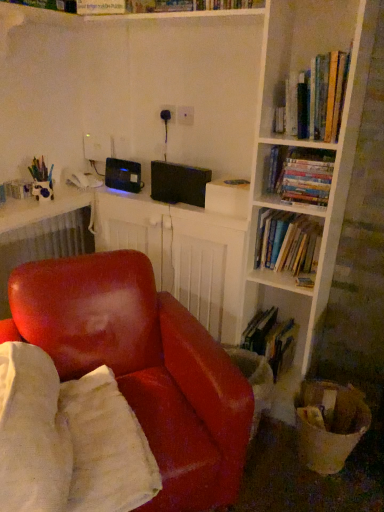
Describe the element at coordinates (167, 113) in the screenshot. I see `matte black outlet at upper center` at that location.

Identify the location of leather at center. The height and width of the screenshot is (512, 384). (143, 366).

At what (x,y) coordinates should I click in order to perform the action: click on hardcover books at upper right, placed as the 3th book when sorted from bottom to top. Please return your answer as a coordinate pair (x, y). The image size is (384, 512). Looking at the image, I should click on (300, 174).

Identify the location of hardcover book at upper center. The width and height of the screenshot is (384, 512). (228, 197).

Is hardcover book at lower center, arranged as the 4th book when viewed from the top, shorter than hardcover books at upper right, acting as the first book starting from the top?

No, hardcover book at lower center, arranged as the 4th book when viewed from the top, is not shorter than hardcover books at upper right, acting as the first book starting from the top.

Looking at this image, is hardcover book at lower center, which is the first book in bottom-to-top order, positioned behind hardcover books at upper right, acting as the first book starting from the top?

Yes, it is behind hardcover books at upper right, acting as the first book starting from the top.

I want to click on the 3rd book to the right when counting from the hardcover book at lower center, arranged as the 4th book when viewed from the top, so click(315, 99).

How different are the orientations of hardcover book at lower center, which is the first book in bottom-to-top order, and hardcover books at upper right, acting as the first book starting from the top, in degrees?

There is a 0.000591-degree angle between the facing directions of hardcover book at lower center, which is the first book in bottom-to-top order, and hardcover books at upper right, acting as the first book starting from the top.

Visually, is hardcover books at upper right, which is counted as the fourth book, starting from the bottom, positioned to the left or to the right of white textured radiator at upper left?

hardcover books at upper right, which is counted as the fourth book, starting from the bottom, is to the right of white textured radiator at upper left.

Does point (280, 130) come closer to viewer compared to point (89, 241)?

Yes, point (280, 130) is closer to viewer.

How far apart are hardcover books at upper right, acting as the first book starting from the top, and white textured radiator at upper left?

hardcover books at upper right, acting as the first book starting from the top, and white textured radiator at upper left are 1.35 meters apart.

Is hardcover books at upper right, which is counted as the fourth book, starting from the bottom, positioned with its back to white textured radiator at upper left?

No, hardcover books at upper right, which is counted as the fourth book, starting from the bottom, is not facing the opposite direction of white textured radiator at upper left.

Would you say hardcover book at upper center contains black plastic speaker at center?

No, hardcover book at upper center does not contain black plastic speaker at center.

From a real-world perspective, who is located higher, hardcover book at upper center or black plastic speaker at center?

black plastic speaker at center.

Is hardcover book at upper center aimed at black plastic speaker at center?

No, hardcover book at upper center is not turned towards black plastic speaker at center.

Are hardcover book at upper center and black plastic speaker at center located far from each other?

No, hardcover book at upper center is not far from black plastic speaker at center.

Are hardcover books at upper right, which is counted as the fourth book, starting from the bottom, and hardcover book at lower center, which is the first book in bottom-to-top order, far apart?

No, hardcover books at upper right, which is counted as the fourth book, starting from the bottom, is not far from hardcover book at lower center, which is the first book in bottom-to-top order.

Between hardcover books at upper right, acting as the first book starting from the top, and hardcover book at lower center, arranged as the 4th book when viewed from the top, which one has more height?

Standing taller between the two is hardcover book at lower center, arranged as the 4th book when viewed from the top.

Considering their positions, is hardcover books at upper right, which is counted as the fourth book, starting from the bottom, located in front of or behind hardcover book at lower center, which is the first book in bottom-to-top order?

Clearly, hardcover books at upper right, which is counted as the fourth book, starting from the bottom, is in front of hardcover book at lower center, which is the first book in bottom-to-top order.

From a real-world perspective, which is physically above, hardcover books at upper right, which is counted as the fourth book, starting from the bottom, or hardcover book at lower center, arranged as the 4th book when viewed from the top?

hardcover books at upper right, which is counted as the fourth book, starting from the bottom, is physically above.

Where is `book that is the 2nd one when counting backward from the hardcover books at upper right, positioned as the second book in top-to-bottom order`? book that is the 2nd one when counting backward from the hardcover books at upper right, positioned as the second book in top-to-bottom order is located at coordinates (271, 339).

Considering the sizes of hardcover books at upper right, placed as the 3th book when sorted from bottom to top, and hardcover book at lower center, which is the first book in bottom-to-top order, in the image, is hardcover books at upper right, placed as the 3th book when sorted from bottom to top, taller or shorter than hardcover book at lower center, which is the first book in bottom-to-top order,?

In the image, hardcover books at upper right, placed as the 3th book when sorted from bottom to top, appears to be shorter than hardcover book at lower center, which is the first book in bottom-to-top order.

From the image's perspective, which object appears higher, hardcover books at upper right, placed as the 3th book when sorted from bottom to top, or hardcover book at lower center, which is the first book in bottom-to-top order?

hardcover books at upper right, placed as the 3th book when sorted from bottom to top, is shown above in the image.

Is hardcover books at upper right, placed as the 3th book when sorted from bottom to top, next to hardcover book at lower center, which is the first book in bottom-to-top order, and touching it?

No, hardcover books at upper right, placed as the 3th book when sorted from bottom to top, is not beside hardcover book at lower center, which is the first book in bottom-to-top order.

Is hardcover books at center right, placed as the 3th book when sorted from top to bottom, not inside black plastic computer desk at center?

That's correct, hardcover books at center right, placed as the 3th book when sorted from top to bottom, is outside of black plastic computer desk at center.

Is hardcover books at center right, positioned as the second book in bottom-to-top order, next to black plastic computer desk at center?

There is a gap between hardcover books at center right, positioned as the second book in bottom-to-top order, and black plastic computer desk at center.

From a real-world perspective, is hardcover books at center right, positioned as the second book in bottom-to-top order, under black plastic computer desk at center?

Actually, hardcover books at center right, positioned as the second book in bottom-to-top order, is physically above black plastic computer desk at center in the real world.

Is hardcover books at center right, placed as the 3th book when sorted from top to bottom, thinner than black plastic computer desk at center?

Indeed, hardcover books at center right, placed as the 3th book when sorted from top to bottom, has a lesser width compared to black plastic computer desk at center.

This screenshot has height=512, width=384. Identify the location of electric outlet that is on the left side of black plastic speaker at center. (167, 113).

Which of these two, matte black outlet at upper center or black plastic speaker at center, is thinner?

Thinner between the two is matte black outlet at upper center.

Does point (174, 115) lie in front of point (208, 179)?

No, it is not.

Are matte black outlet at upper center and black plastic speaker at center beside each other?

No, matte black outlet at upper center is not with black plastic speaker at center.

You are a GUI agent. You are given a task and a screenshot of the screen. Output one action in this format:
    pyautogui.click(x=<x>, y=<y>)
    Task: Click on the 3rd book behind the hardcover books at upper right, which is counted as the fourth book, starting from the bottom
    This screenshot has width=384, height=512.
    Given the screenshot: What is the action you would take?
    pyautogui.click(x=271, y=339)

Image resolution: width=384 pixels, height=512 pixels. Find the location of `radiator below the hardcover books at upper right, acting as the first book starting from the top (from the image's perspective)`. radiator below the hardcover books at upper right, acting as the first book starting from the top (from the image's perspective) is located at coordinates (43, 245).

Considering their positions, is hardcover books at upper right, placed as the 3th book when sorted from bottom to top, positioned closer to white textured radiator at upper left than hardcover book at upper center?

→ Among the two, hardcover book at upper center is located nearer to white textured radiator at upper left.

Estimate the real-world distances between objects in this image. Which object is further from black plastic speaker at center, hardcover book at upper center or hardcover book at lower center, arranged as the 4th book when viewed from the top?

Among the two, hardcover book at lower center, arranged as the 4th book when viewed from the top, is located further to black plastic speaker at center.

Looking at the image, which one is located further to hardcover books at upper right, which is counted as the fourth book, starting from the bottom, matte black outlet at upper center or hardcover books at upper right, placed as the 3th book when sorted from bottom to top?

The object further to hardcover books at upper right, which is counted as the fourth book, starting from the bottom, is matte black outlet at upper center.

In the scene shown: From the image, which object appears to be farther from leather at center, hardcover books at center right, placed as the 3th book when sorted from top to bottom, or hardcover book at lower center, which is the first book in bottom-to-top order?

The object further to leather at center is hardcover books at center right, placed as the 3th book when sorted from top to bottom.

Considering their positions, is white textured radiator at upper left positioned closer to matte black outlet at upper center than black plastic speaker at center?

black plastic speaker at center lies closer to matte black outlet at upper center than the other object.

Considering their positions, is white textured radiator at upper left positioned further to hardcover book at lower center, arranged as the 4th book when viewed from the top, than hardcover book at upper center?

white textured radiator at upper left.

From the image, which object appears to be farther from hardcover books at center right, positioned as the second book in bottom-to-top order, hardcover books at upper right, placed as the 3th book when sorted from bottom to top, or matte black outlet at upper center?

Based on the image, matte black outlet at upper center appears to be further to hardcover books at center right, positioned as the second book in bottom-to-top order.

From the image, which object appears to be farther from hardcover book at upper center, hardcover books at upper right, acting as the first book starting from the top, or matte black outlet at upper center?

matte black outlet at upper center lies further to hardcover book at upper center than the other object.

I want to click on book between hardcover books at upper right, which is counted as the fourth book, starting from the bottom, and hardcover book at upper center vertically, so click(300, 174).

Where is `paperback book located between white textured radiator at upper left and hardcover books at upper right, positioned as the second book in top-to-bottom order, in the left-right direction`? paperback book located between white textured radiator at upper left and hardcover books at upper right, positioned as the second book in top-to-bottom order, in the left-right direction is located at coordinates (228, 197).

Image resolution: width=384 pixels, height=512 pixels. What are the coordinates of `paperback book between black plastic computer desk at center and hardcover books at upper right, placed as the 3th book when sorted from bottom to top, from left to right` in the screenshot? It's located at (228, 197).

Image resolution: width=384 pixels, height=512 pixels. I want to click on speaker that lies between hardcover books at upper right, which is counted as the fourth book, starting from the bottom, and hardcover book at lower center, arranged as the 4th book when viewed from the top, from top to bottom, so click(179, 183).